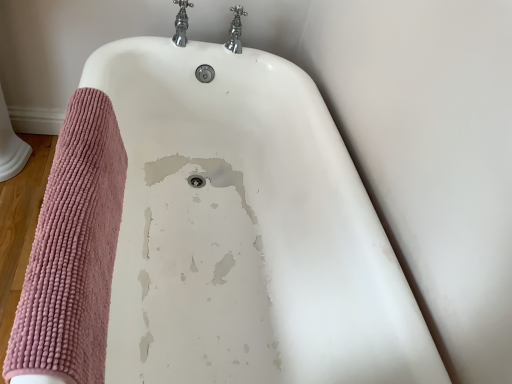
Question: Is white glossy bathtub at center far away from chrome metallic faucet at upper center, which is the second tap in right-to-left order?

Choices:
 (A) no
 (B) yes

Answer: (A)

Question: Is white glossy bathtub at center taller than chrome metallic faucet at upper center, positioned as the 1th tap in left-to-right order?

Choices:
 (A) no
 (B) yes

Answer: (B)

Question: Does white glossy bathtub at center have a lesser height compared to chrome metallic faucet at upper center, which is the second tap in right-to-left order?

Choices:
 (A) yes
 (B) no

Answer: (B)

Question: Does white glossy bathtub at center have a greater width compared to chrome metallic faucet at upper center, positioned as the 1th tap in left-to-right order?

Choices:
 (A) yes
 (B) no

Answer: (A)

Question: Is white glossy bathtub at center aimed at chrome metallic faucet at upper center, which is the second tap in right-to-left order?

Choices:
 (A) yes
 (B) no

Answer: (B)

Question: Is white glossy bathtub at center smaller than chrome metallic faucet at upper center, positioned as the 1th tap in left-to-right order?

Choices:
 (A) no
 (B) yes

Answer: (A)

Question: From the image's perspective, is white glossy bathtub at center beneath chrome metallic faucet at upper center, the second tap when ordered from left to right?

Choices:
 (A) no
 (B) yes

Answer: (B)

Question: Is white glossy bathtub at center not inside chrome metallic faucet at upper center, acting as the first tap starting from the right?

Choices:
 (A) no
 (B) yes

Answer: (B)

Question: Is white glossy bathtub at center in front of chrome metallic faucet at upper center, the second tap when ordered from left to right?

Choices:
 (A) yes
 (B) no

Answer: (A)

Question: Is white glossy bathtub at center further to camera compared to chrome metallic faucet at upper center, acting as the first tap starting from the right?

Choices:
 (A) no
 (B) yes

Answer: (A)

Question: Considering the relative sizes of white glossy bathtub at center and chrome metallic faucet at upper center, acting as the first tap starting from the right, in the image provided, is white glossy bathtub at center thinner than chrome metallic faucet at upper center, acting as the first tap starting from the right,?

Choices:
 (A) no
 (B) yes

Answer: (A)

Question: Is white glossy bathtub at center not close to chrome metallic faucet at upper center, acting as the first tap starting from the right?

Choices:
 (A) no
 (B) yes

Answer: (A)

Question: Would you say chrome metallic faucet at upper center, the second tap when ordered from left to right, contains white glossy bathtub at center?

Choices:
 (A) no
 (B) yes

Answer: (A)